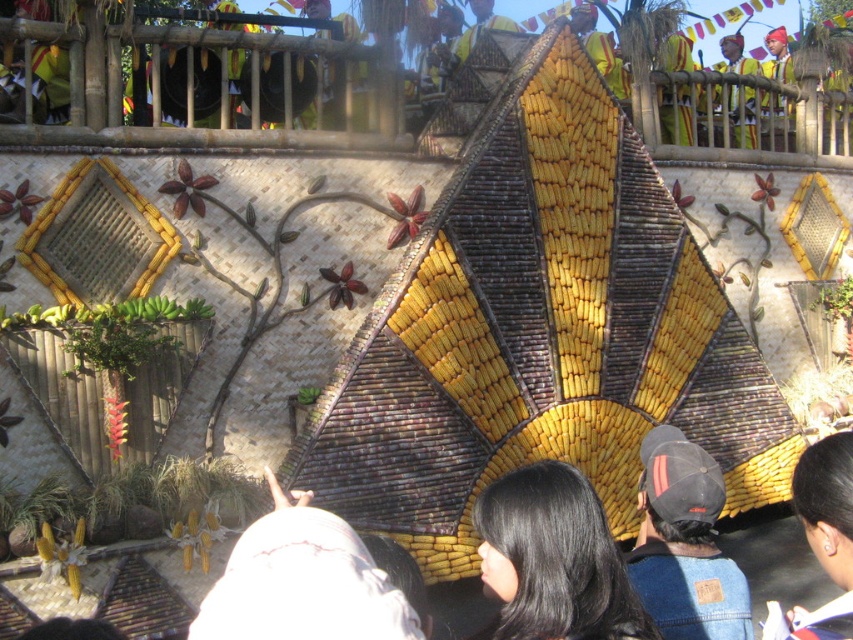
You are standing in front of the festival structure and want to touch the yellow matte corn at center and the white fabric at center. Which object can you reach first without moving your position?

The yellow matte corn at center is closer to you than the white fabric at center, so you can reach it first without moving.

You are standing at the edge of the festival area and want to take a photo of both the yellow matte corn at center and the denim cap at center in the same frame. Given that your camera has a maximum zoom range of 10 meters, will you be able to capture both objects in a single photo?

The yellow matte corn at center and denim cap at center are 14.09 meters apart from each other. Since the maximum zoom range of your camera is 10 meters, you won directly capture both objects in a single photo as the distance exceeds the camera limit.

You are an artist planning to sketch the festival scene. You need to decide which object to focus on first based on their sizes. Which one should you draw first, the yellow matte corn at center or the white fabric at center?

The yellow matte corn at center has a larger size compared to the white fabric at center, so you should draw the yellow matte corn at center first to ensure it is proportionally accurate before adding smaller details like the white fabric at center.